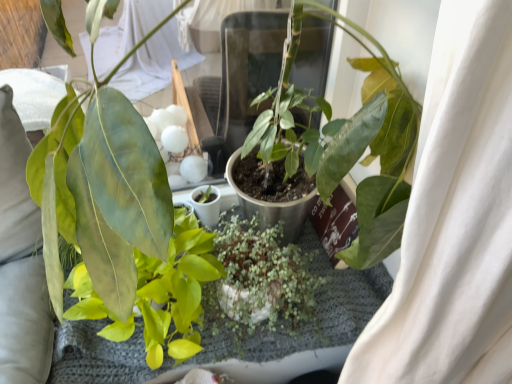
Question: Which direction should I rotate to look at green matte succulent at center, the 1th houseplant in the right-to-left sequence?

Choices:
 (A) left
 (B) right

Answer: (A)

Question: Is green glossy leaf at center, which ranks as the 2th houseplant in right-to-left order, shorter than green matte succulent at center, the second houseplant viewed from the left?

Choices:
 (A) yes
 (B) no

Answer: (B)

Question: Considering the relative sizes of green glossy leaf at center, positioned as the first houseplant in left-to-right order, and green matte succulent at center, the 1th houseplant in the right-to-left sequence, in the image provided, is green glossy leaf at center, positioned as the first houseplant in left-to-right order, smaller than green matte succulent at center, the 1th houseplant in the right-to-left sequence,?

Choices:
 (A) yes
 (B) no

Answer: (B)

Question: From the image's perspective, is green glossy leaf at center, which ranks as the 2th houseplant in right-to-left order, on top of green matte succulent at center, the 1th houseplant in the right-to-left sequence?

Choices:
 (A) no
 (B) yes

Answer: (B)

Question: Considering the relative sizes of green glossy leaf at center, positioned as the first houseplant in left-to-right order, and green matte succulent at center, the 1th houseplant in the right-to-left sequence, in the image provided, is green glossy leaf at center, positioned as the first houseplant in left-to-right order, wider than green matte succulent at center, the 1th houseplant in the right-to-left sequence,?

Choices:
 (A) yes
 (B) no

Answer: (A)

Question: Considering the relative sizes of green glossy leaf at center, positioned as the first houseplant in left-to-right order, and green matte succulent at center, the 1th houseplant in the right-to-left sequence, in the image provided, is green glossy leaf at center, positioned as the first houseplant in left-to-right order, bigger than green matte succulent at center, the 1th houseplant in the right-to-left sequence,?

Choices:
 (A) no
 (B) yes

Answer: (B)

Question: Is green glossy leaf at center, which ranks as the 2th houseplant in right-to-left order, looking in the opposite direction of green matte succulent at center, the 1th houseplant in the right-to-left sequence?

Choices:
 (A) no
 (B) yes

Answer: (A)

Question: Is green matte succulent at center, the second houseplant viewed from the left, shorter than green glossy leaf at center, which ranks as the 2th houseplant in right-to-left order?

Choices:
 (A) no
 (B) yes

Answer: (B)

Question: From a real-world perspective, is green matte succulent at center, the second houseplant viewed from the left, physically above green glossy leaf at center, which ranks as the 2th houseplant in right-to-left order?

Choices:
 (A) no
 (B) yes

Answer: (A)

Question: Does green matte succulent at center, the second houseplant viewed from the left, have a greater height compared to green glossy leaf at center, which ranks as the 2th houseplant in right-to-left order?

Choices:
 (A) no
 (B) yes

Answer: (A)

Question: Is the surface of green matte succulent at center, the 1th houseplant in the right-to-left sequence, in direct contact with green glossy leaf at center, positioned as the first houseplant in left-to-right order?

Choices:
 (A) yes
 (B) no

Answer: (B)

Question: Does green matte succulent at center, the 1th houseplant in the right-to-left sequence, have a greater width compared to green glossy leaf at center, which ranks as the 2th houseplant in right-to-left order?

Choices:
 (A) no
 (B) yes

Answer: (A)

Question: From the image's perspective, is green matte succulent at center, the second houseplant viewed from the left, above green glossy leaf at center, which ranks as the 2th houseplant in right-to-left order?

Choices:
 (A) yes
 (B) no

Answer: (B)

Question: From their relative heights in the image, would you say green glossy leaf at center, which ranks as the 2th houseplant in right-to-left order, is taller or shorter than green matte succulent at center, the 1th houseplant in the right-to-left sequence?

Choices:
 (A) short
 (B) tall

Answer: (B)